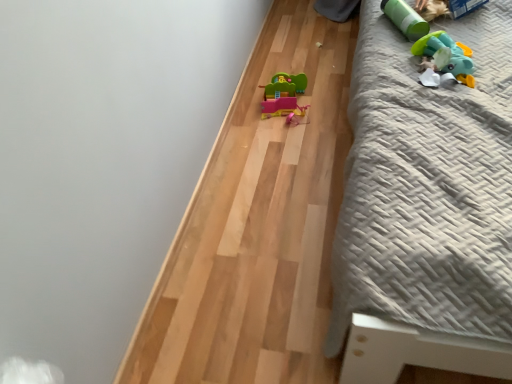
This screenshot has height=384, width=512. Find the location of `free location to the left of matte plastic toy car at center, which is the 1th toy in back-to-front order`. free location to the left of matte plastic toy car at center, which is the 1th toy in back-to-front order is located at coordinates (244, 111).